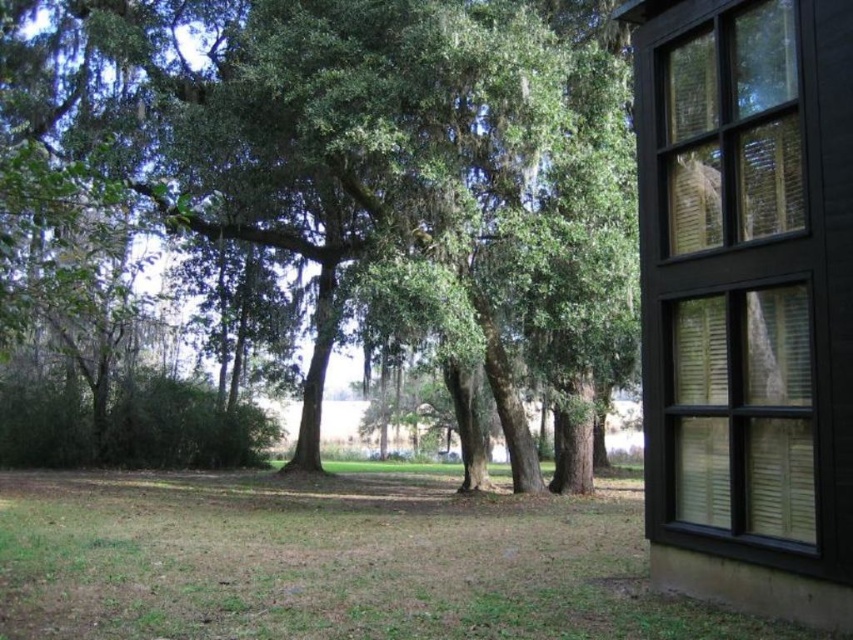
Is green leafy tree at center taller than black wooden window at right?

Yes, green leafy tree at center is taller than black wooden window at right.

Can you confirm if green leafy tree at center is positioned below black wooden window at right?

Yes, green leafy tree at center is below black wooden window at right.

Is point (103, 106) closer to camera compared to point (682, 404)?

No, (103, 106) is further to viewer.

Identify the location of green leafy tree at center. (338, 173).

Is black wooden window at right positioned behind green grass at lower center?

Yes, it is behind green grass at lower center.

Where is `black wooden window at right`? black wooden window at right is located at coordinates (746, 276).

From the picture: Does green leafy tree at center have a lesser width compared to green grass at lower center?

Incorrect, green leafy tree at center's width is not less than green grass at lower center's.

Does green leafy tree at center have a larger size compared to green grass at lower center?

Indeed, green leafy tree at center has a larger size compared to green grass at lower center.

Who is more distant from viewer, [62,262] or [218,608]?

The point [62,262] is behind.

Find the location of a particular element. The image size is (853, 640). green leafy tree at center is located at coordinates (338, 173).